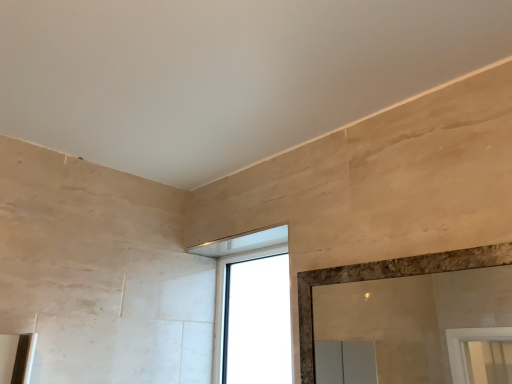
Locate an element on the screen. The height and width of the screenshot is (384, 512). transparent glass window at center is located at coordinates (252, 308).

Describe the element at coordinates (252, 308) in the screenshot. I see `transparent glass window at center` at that location.

At what (x,y) coordinates should I click in order to perform the action: click on transparent glass window at center. Please return your answer as a coordinate pair (x, y). Looking at the image, I should click on (252, 308).